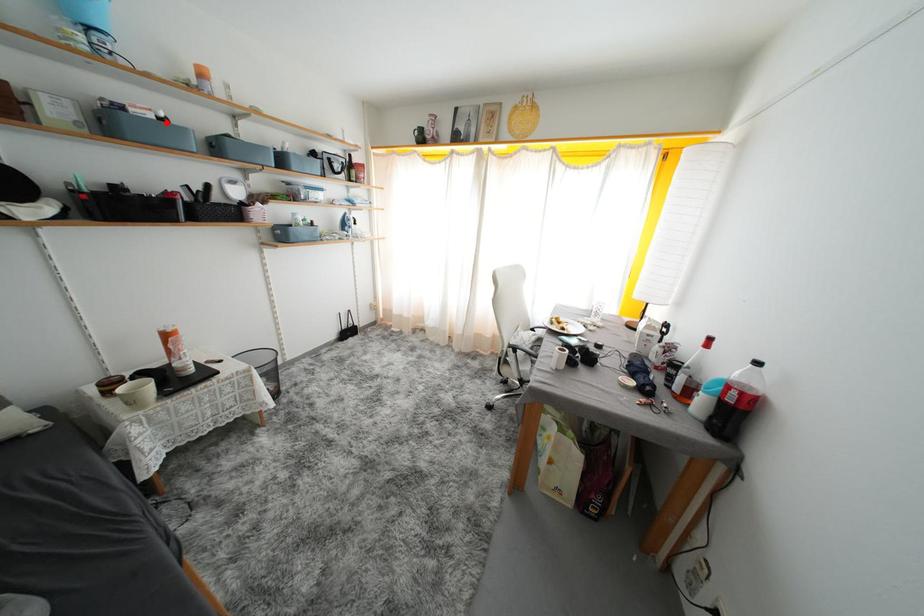
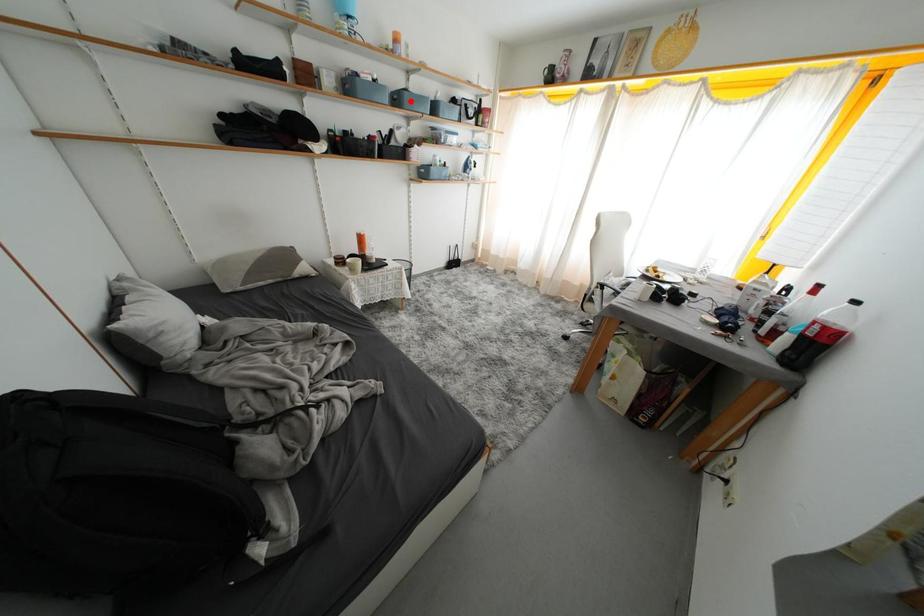
I am providing you with two images of the same scene from different viewpoints. A red point is marked on the first image and another point is marked on the second image. Do the highlighted points in image1 and image2 indicate the same real-world spot?

No